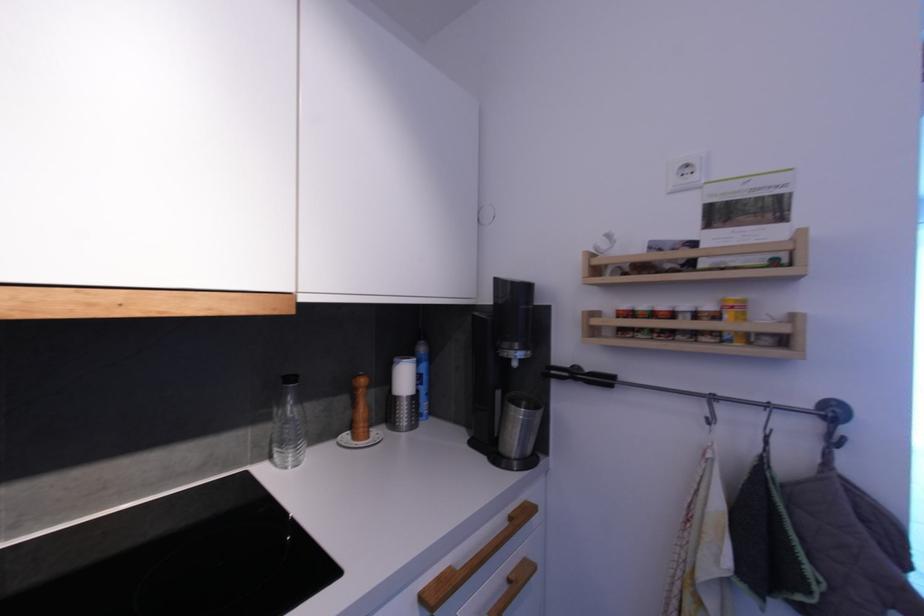
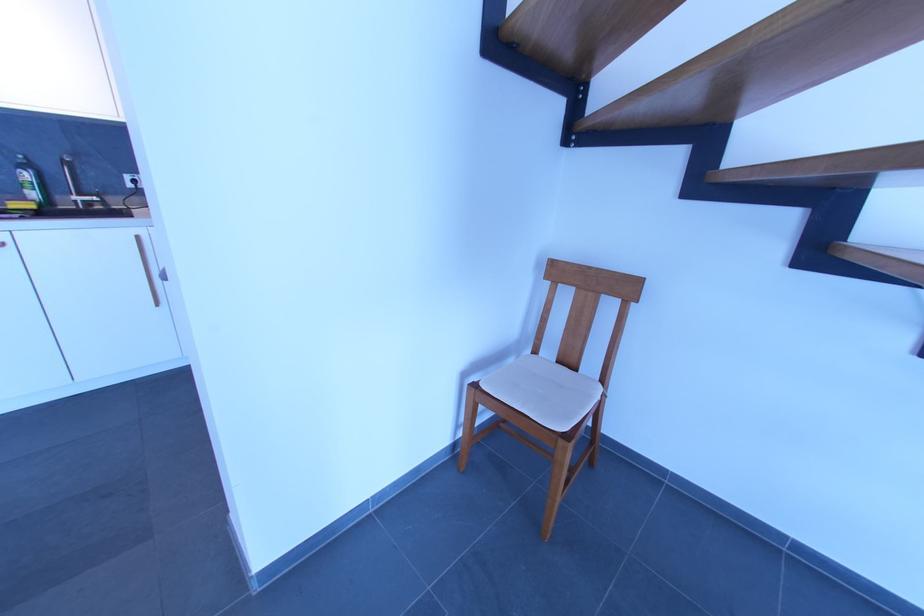
Question: I am providing you with two images of the same scene from different viewpoints. Which of the following objects are not visible in image2?

Choices:
 (A) clear glass bottle
 (B) wooden cabinet handle
 (C) grey shark pillow
 (D) chair sitting surface

Answer: (A)